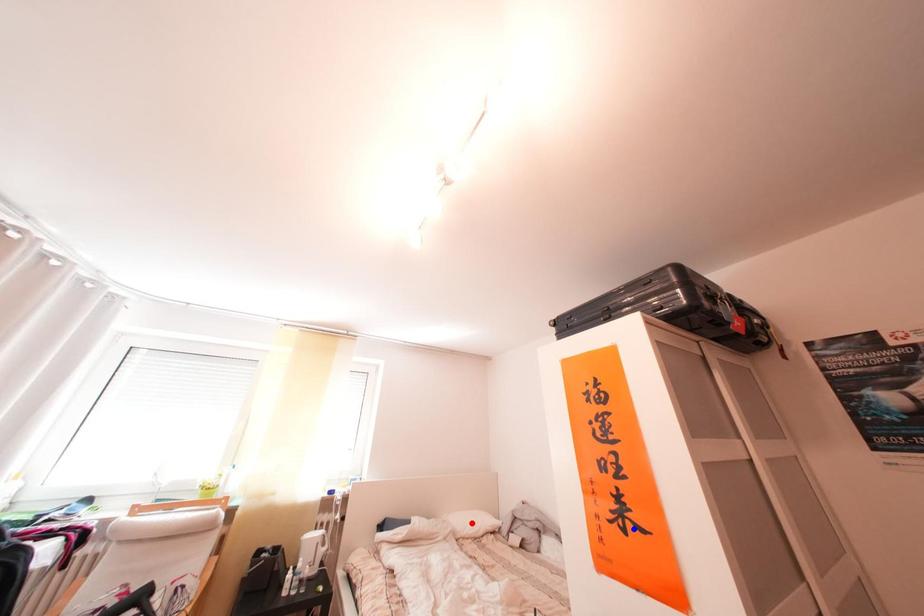
Question: Which of the two points in the image is closer to the camera?

Choices:
 (A) Blue point is closer.
 (B) Red point is closer.

Answer: (A)